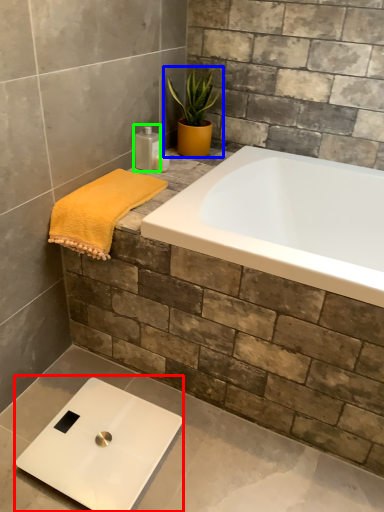
Question: Which object is the closest to the scale (highlighted by a red box)? Choose among these: houseplant (highlighted by a blue box) or toiletry (highlighted by a green box).

Choices:
 (A) houseplant
 (B) toiletry

Answer: (B)